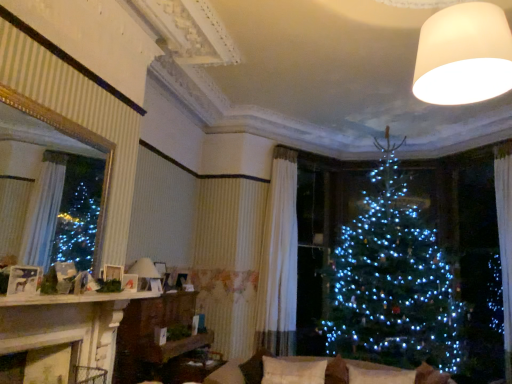
Question: Is point (121, 271) closer or farther from the camera than point (25, 269)?

Choices:
 (A) closer
 (B) farther

Answer: (B)

Question: From a real-world perspective, relative to matte white picture frame at left, the 2th picture frame positioned from the bottom, is matte white picture frame at upper left, which ranks as the 2th picture frame in front-to-back order, vertically above or below?

Choices:
 (A) above
 (B) below

Answer: (A)

Question: Which is farther from the white soft cushion at center, marked as the 1th pillow in a left-to-right arrangement?

Choices:
 (A) wooden shelf at center
 (B) matte white picture frame at upper left, which ranks as the 2th picture frame in front-to-back order
 (C) white textured curtain at center
 (D) gold-framed mirror at left
 (E) white glossy mantel at lower left

Answer: (D)

Question: Estimate the real-world distances between objects in this image. Which object is farther from the wooden shelf at center?

Choices:
 (A) white soft pillow at lower center, which appears as the first pillow when viewed from the right
 (B) gold-framed mirror at left
 (C) matte white picture frame at left, the first picture frame in the top-to-bottom sequence
 (D) matte white picture frame at upper left, the 1th picture frame viewed from the back
 (E) white textured curtain at center

Answer: (C)